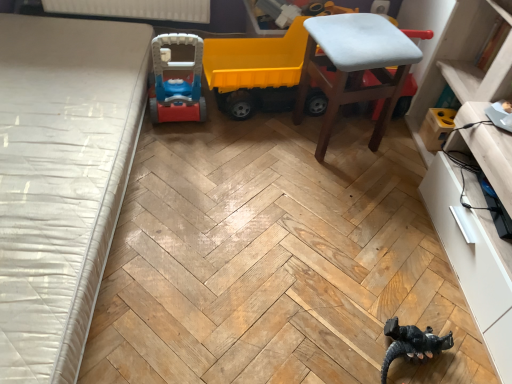
Find the location of a particular element. vacant area that lies between light blue fabric stool at upper right and yellow plastic toy truck at center is located at coordinates (267, 135).